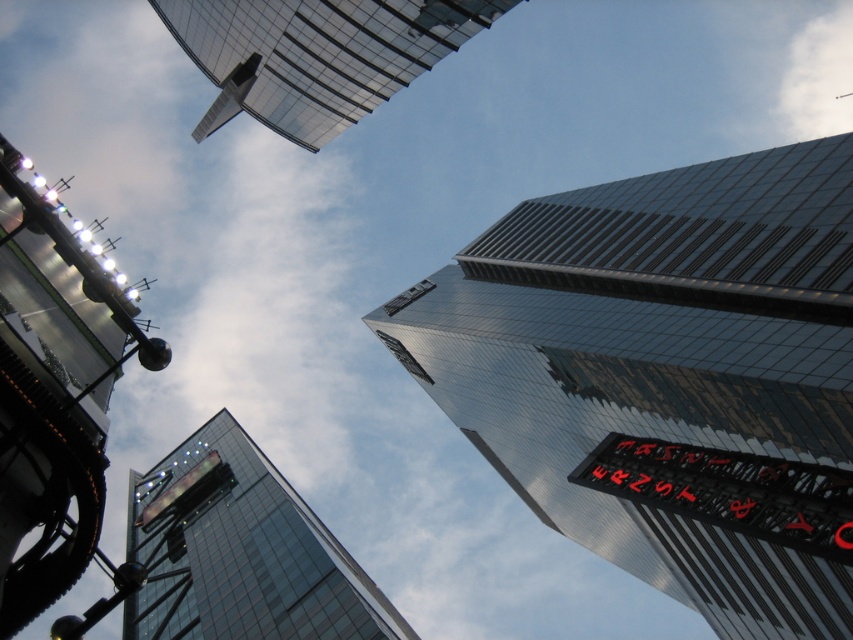
Does shiny glass skyscraper at upper right come in front of red led sign at right?

No, it is not.

Which is behind, point (509, 451) or point (817, 545)?

Positioned behind is point (509, 451).

Does point (791, 227) lie in front of point (780, 486)?

No, it is not.

Where is `shiny glass skyscraper at upper right`? shiny glass skyscraper at upper right is located at coordinates (666, 376).

Is metallic glass tower at upper left thinner than transparent glass tower at center?

Yes, metallic glass tower at upper left is thinner than transparent glass tower at center.

Does metallic glass tower at upper left appear on the right side of transparent glass tower at center?

Indeed, metallic glass tower at upper left is positioned on the right side of transparent glass tower at center.

Does point (106, 278) come in front of point (300, 632)?

Yes, it is.

Where is `metallic glass tower at upper left`? This screenshot has width=853, height=640. metallic glass tower at upper left is located at coordinates (53, 396).

Describe the element at coordinates (666, 376) in the screenshot. I see `shiny glass skyscraper at upper right` at that location.

Based on the photo, between shiny glass skyscraper at upper right and metallic glass tower at upper left, which one has more height?

With more height is shiny glass skyscraper at upper right.

This screenshot has height=640, width=853. I want to click on shiny glass skyscraper at upper right, so click(x=666, y=376).

You are a GUI agent. You are given a task and a screenshot of the screen. Output one action in this format:
    pyautogui.click(x=<x>, y=<y>)
    Task: Click on the shiny glass skyscraper at upper right
    
    Given the screenshot: What is the action you would take?
    pyautogui.click(x=666, y=376)